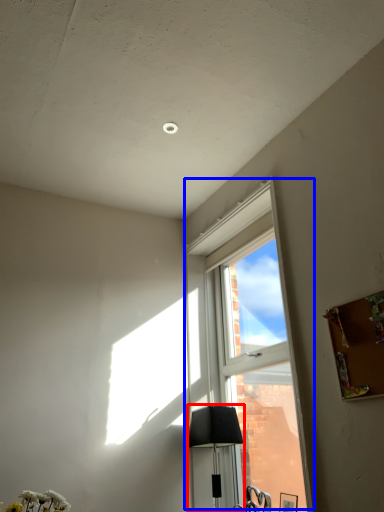
Question: Which point is further to the camera, lamp (highlighted by a red box) or window (highlighted by a blue box)?

Choices:
 (A) lamp
 (B) window

Answer: (A)